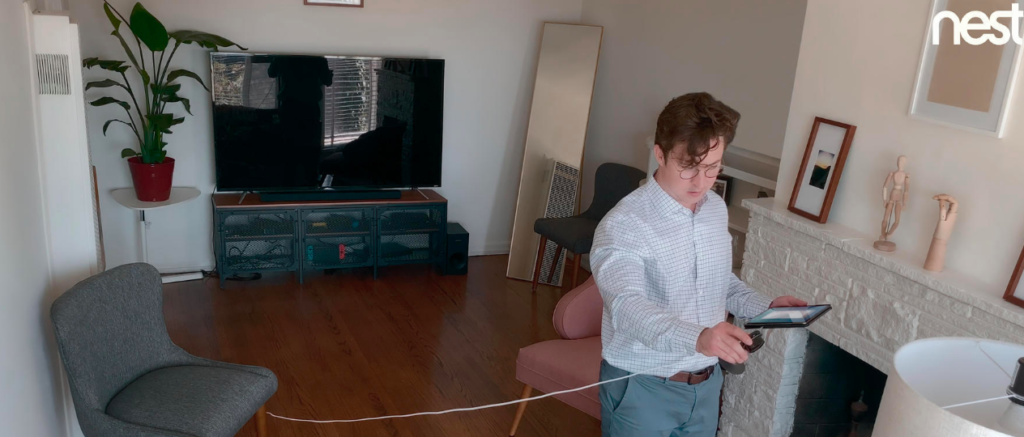
Locate an element on the screen. Image resolution: width=1024 pixels, height=437 pixels. decorative art is located at coordinates (893, 189), (942, 223), (810, 158), (948, 86), (1013, 289).